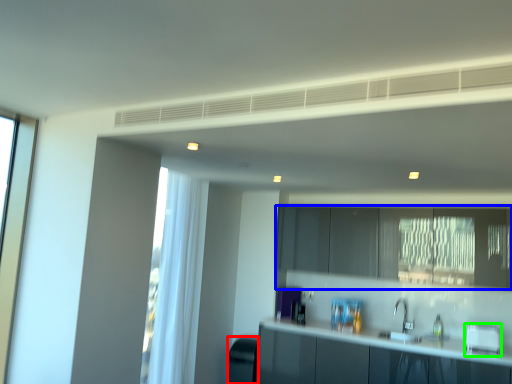
Question: Which object is positioned farthest from appliance (highlighted by a red box)? Select from cabinetry (highlighted by a blue box) and appliance (highlighted by a green box).

Choices:
 (A) cabinetry
 (B) appliance

Answer: (B)